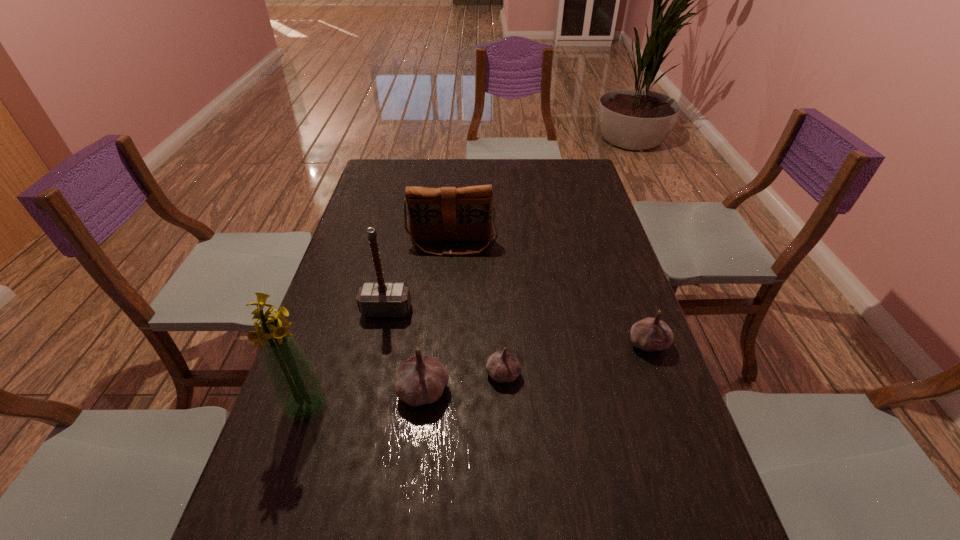
At what (x,y) coordinates should I click in order to perform the action: click on garlic that is the closest to the fifth shortest object. Please return your answer as a coordinate pair (x, y). This screenshot has width=960, height=540. Looking at the image, I should click on (420, 380).

The height and width of the screenshot is (540, 960). I want to click on vacant position in the image that satisfies the following two spatial constraints: 1. on the striking surface of the fifth tallest object; 2. on the right side of the second tallest object, so click(x=379, y=343).

Where is `vacant point that satisfies the following two spatial constraints: 1. on the striking surface of the fifth shortest object; 2. on the right side of the shortest garlic`? The image size is (960, 540). vacant point that satisfies the following two spatial constraints: 1. on the striking surface of the fifth shortest object; 2. on the right side of the shortest garlic is located at coordinates (372, 374).